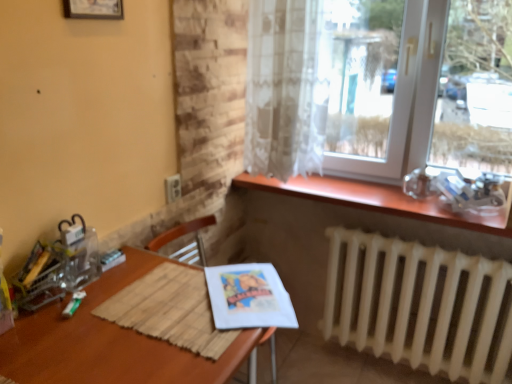
Question: Is sheer white curtain at upper right inside white matte radiator at lower right?

Choices:
 (A) no
 (B) yes

Answer: (A)

Question: Considering the relative positions of white matte radiator at lower right and sheer white curtain at upper right in the image provided, is white matte radiator at lower right behind sheer white curtain at upper right?

Choices:
 (A) yes
 (B) no

Answer: (A)

Question: Is white matte radiator at lower right turned away from sheer white curtain at upper right?

Choices:
 (A) no
 (B) yes

Answer: (A)

Question: Would you say white matte radiator at lower right is outside sheer white curtain at upper right?

Choices:
 (A) yes
 (B) no

Answer: (A)

Question: Is white matte radiator at lower right oriented towards sheer white curtain at upper right?

Choices:
 (A) no
 (B) yes

Answer: (A)

Question: From the image's perspective, is brown wooden table at center positioned above or below wooden armchair at center?

Choices:
 (A) below
 (B) above

Answer: (A)

Question: From a real-world perspective, relative to wooden armchair at center, is brown wooden table at center vertically above or below?

Choices:
 (A) below
 (B) above

Answer: (B)

Question: In terms of size, does brown wooden table at center appear bigger or smaller than wooden armchair at center?

Choices:
 (A) small
 (B) big

Answer: (B)

Question: Is point (106, 374) positioned closer to the camera than point (271, 349)?

Choices:
 (A) closer
 (B) farther

Answer: (A)

Question: From their relative heights in the image, would you say matte paper magazine at lower center is taller or shorter than wooden picture frame at upper left?

Choices:
 (A) tall
 (B) short

Answer: (A)

Question: From the image's perspective, is matte paper magazine at lower center located above or below wooden picture frame at upper left?

Choices:
 (A) above
 (B) below

Answer: (B)

Question: In terms of width, does matte paper magazine at lower center look wider or thinner when compared to wooden picture frame at upper left?

Choices:
 (A) thin
 (B) wide

Answer: (B)

Question: From a real-world perspective, is matte paper magazine at lower center physically located above or below wooden picture frame at upper left?

Choices:
 (A) below
 (B) above

Answer: (A)

Question: Is white matte radiator at lower right wider or thinner than brown wooden table at center?

Choices:
 (A) thin
 (B) wide

Answer: (A)

Question: From a real-world perspective, is white matte radiator at lower right positioned above or below brown wooden table at center?

Choices:
 (A) below
 (B) above

Answer: (A)